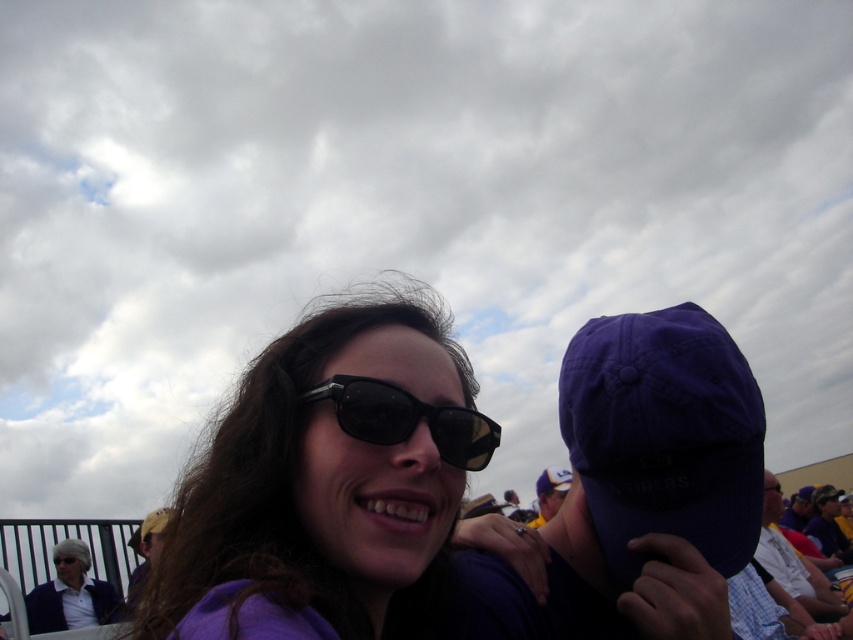
You are a photographer trying to capture a clear photo of the black plastic sunglasses at center. However, the matte blue jacket at lower left is blocking your view. Can you move around to the right side to get an unobstructed shot?

The matte blue jacket at lower left is in front of the black plastic sunglasses at center, so moving to the right side might allow you to see around the jacket and capture the sunglasses without obstruction.

Looking at this image, you are standing at the center of the image and want to locate the matte blue jacket at lower left. Which direction should you look to find it?

You should look to the lower left direction to find the matte blue jacket at lower left, as it is located at point (73, 595).

You are a photographer trying to capture a candid shot of the purple fabric cap at center and the matte blue jacket at lower left. Since you want to ensure both are visible in the frame, which object should you focus on first to maintain their visibility?

The purple fabric cap at center has a lesser height compared to matte blue jacket at lower left, so you should focus on the purple fabric cap at center first to ensure it stays visible in the frame.